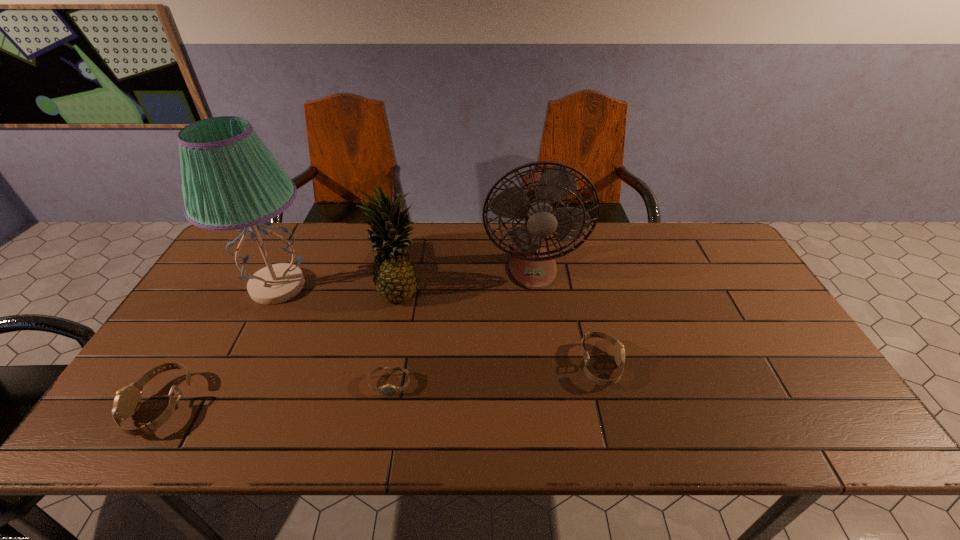
Locate an element on the screen. The image size is (960, 540). the leftmost watch is located at coordinates (127, 401).

I want to click on the second watch from right to left, so click(389, 390).

You are a GUI agent. You are given a task and a screenshot of the screen. Output one action in this format:
    pyautogui.click(x=<x>, y=<y>)
    Task: Click on the shortest object
    
    Given the screenshot: What is the action you would take?
    pyautogui.click(x=389, y=390)

Identify the location of the second tallest watch. (619, 352).

Find the location of a particular element. the second shortest object is located at coordinates (619, 352).

Locate an element on the screen. The image size is (960, 540). fan is located at coordinates (531, 265).

What are the coordinates of `the tallest object` in the screenshot? It's located at (230, 180).

This screenshot has height=540, width=960. I want to click on pineapple, so tap(395, 279).

Locate an element on the screen. This screenshot has height=540, width=960. free spot located on the face of the second shortest watch is located at coordinates (732, 365).

Locate an element on the screen. The height and width of the screenshot is (540, 960). vacant space located 0.380m in front of the fan to direct airflow is located at coordinates (551, 406).